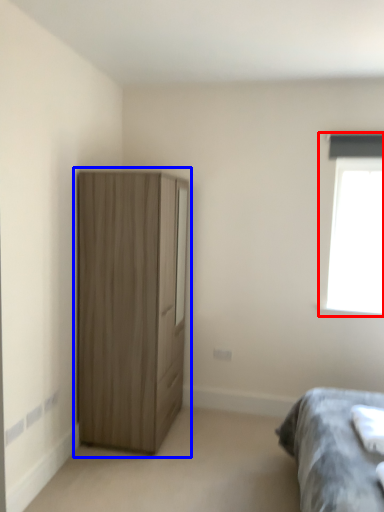
Question: Which object appears farthest to the camera in this image, window (highlighted by a red box) or cupboard (highlighted by a blue box)?

Choices:
 (A) window
 (B) cupboard

Answer: (A)